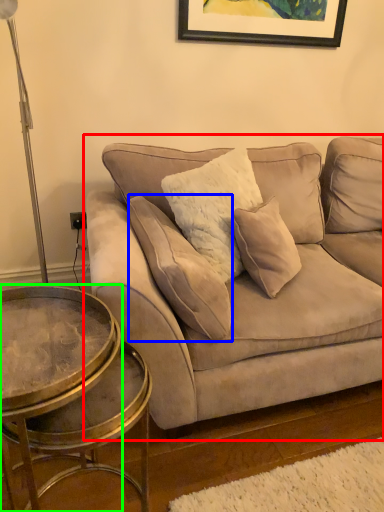
Question: Which object is positioned closest to studio couch (highlighted by a red box)? Select from pillow (highlighted by a blue box) and coffee table (highlighted by a green box).

Choices:
 (A) pillow
 (B) coffee table

Answer: (A)